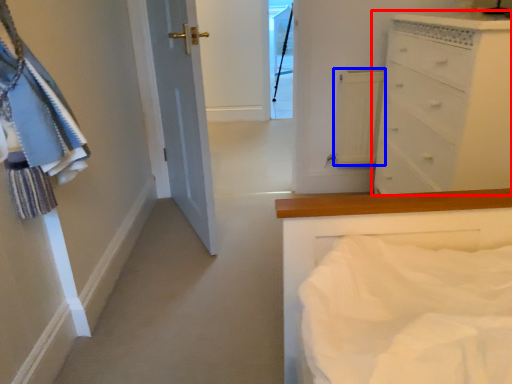
Question: Which object is further to the camera taking this photo, chest of drawers (highlighted by a red box) or cabinetry (highlighted by a blue box)?

Choices:
 (A) chest of drawers
 (B) cabinetry

Answer: (B)